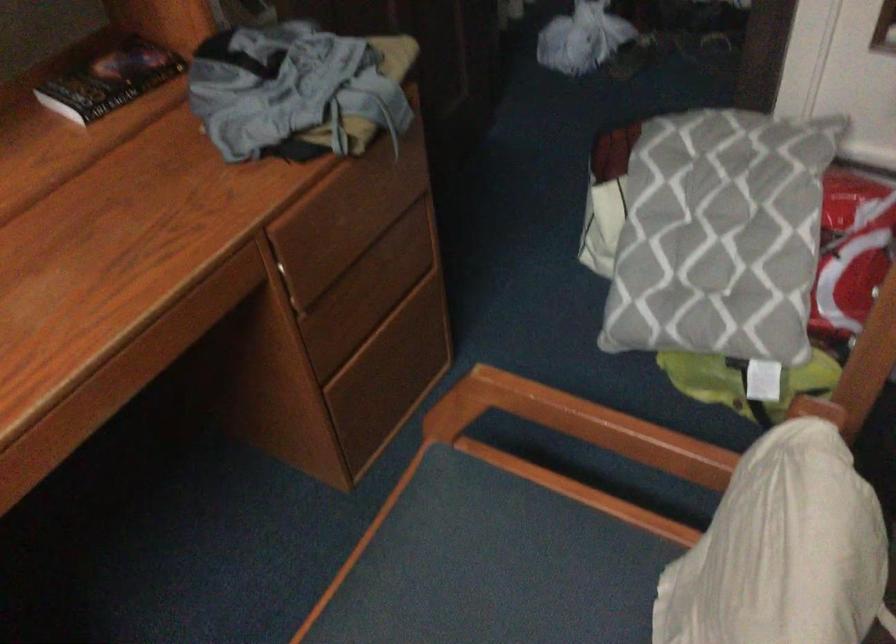
Image resolution: width=896 pixels, height=644 pixels. Describe the element at coordinates (579, 424) in the screenshot. I see `a wooden chair armrest` at that location.